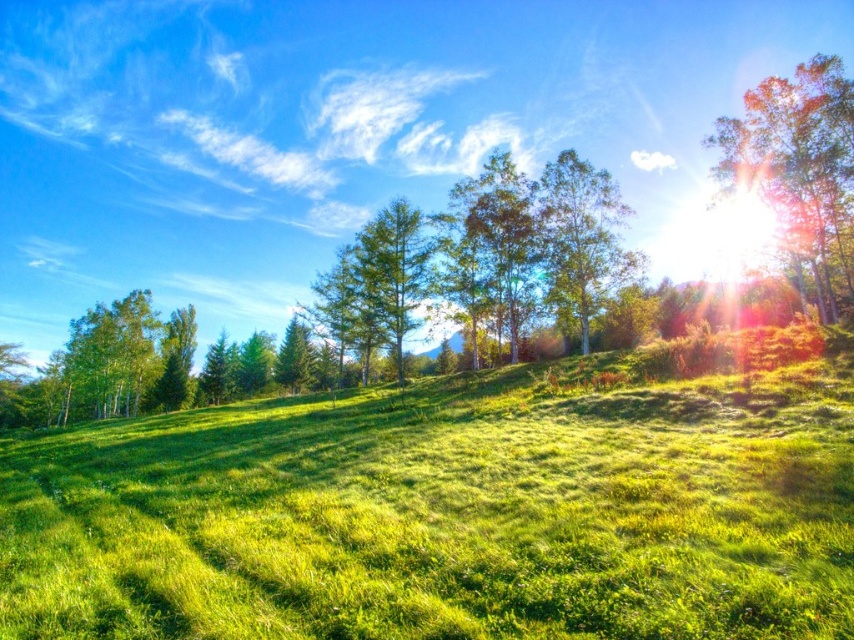
Is green soft grass at center closer to camera compared to green leafy tree at upper right?

Yes.

Is green soft grass at center bigger than green leafy tree at upper right?

Actually, green soft grass at center might be smaller than green leafy tree at upper right.

Find the location of a particular element. The image size is (854, 640). green soft grass at center is located at coordinates (448, 509).

Is green soft grass at center in front of green leafy tree at center?

Yes.

Measure the distance between green soft grass at center and camera.

green soft grass at center is 5.44 meters away from camera.

In order to click on green soft grass at center in this screenshot , I will do `click(448, 509)`.

Is green leafy tree at upper right thinner than green leafy tree at center?

No.

You are a GUI agent. You are given a task and a screenshot of the screen. Output one action in this format:
    pyautogui.click(x=<x>, y=<y>)
    Task: Click on the green leafy tree at upper right
    
    Given the screenshot: What is the action you would take?
    pyautogui.click(x=799, y=170)

Measure the distance between point (x=823, y=236) and camera.

Point (x=823, y=236) and camera are 44.78 meters apart.

Where is `green leafy tree at upper right`? green leafy tree at upper right is located at coordinates (799, 170).